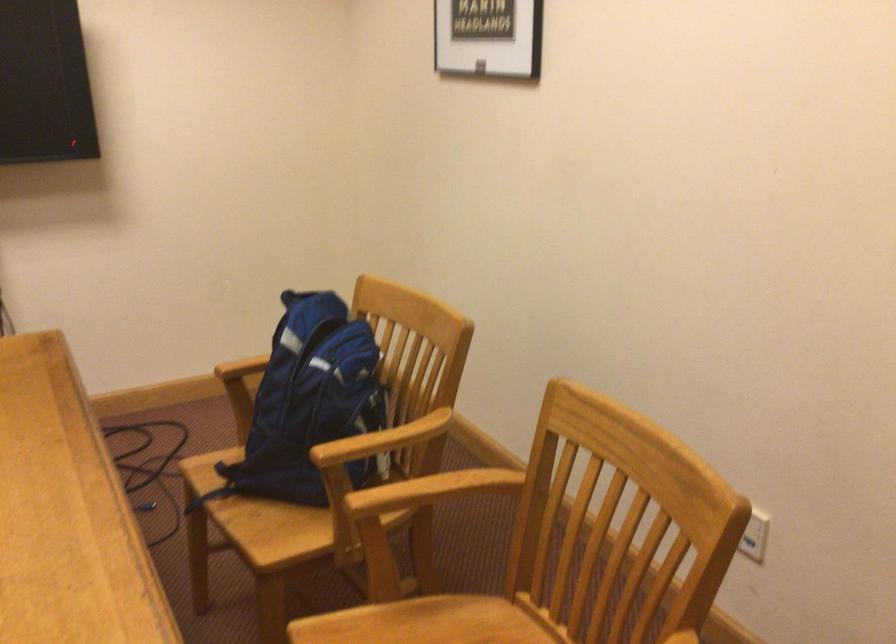
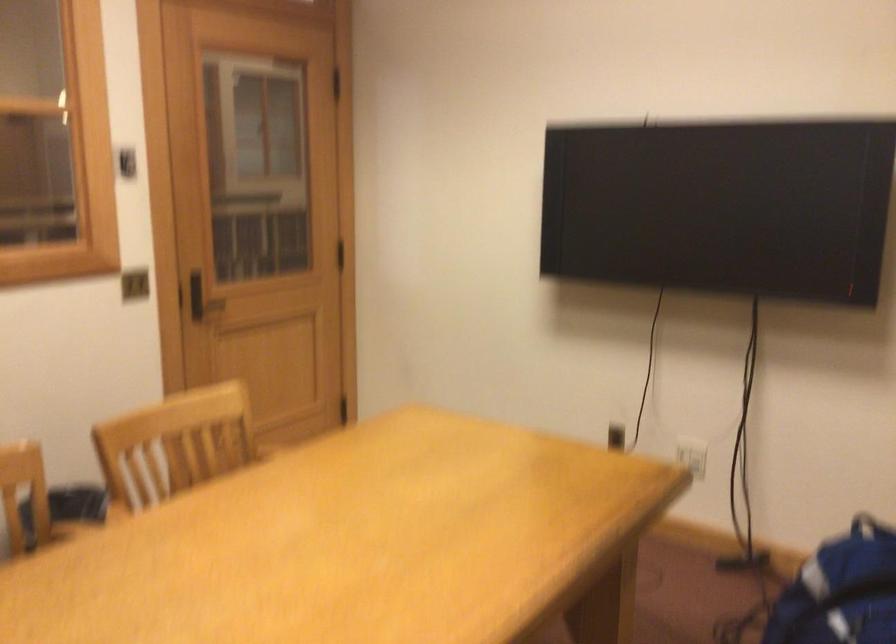
Question: How did the camera likely rotate?

Choices:
 (A) Left
 (B) Right
 (C) Up
 (D) Down

Answer: (A)